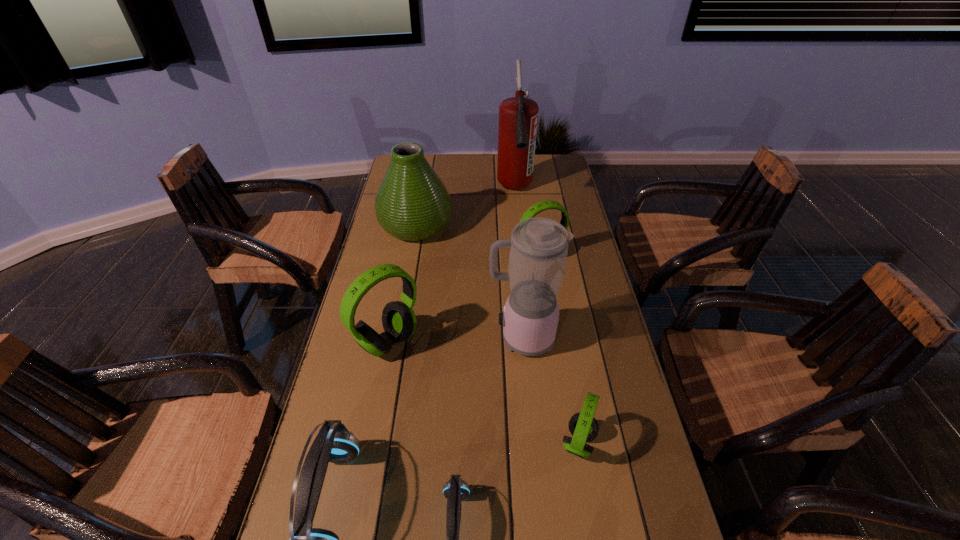
The width and height of the screenshot is (960, 540). In order to click on headset at the left edge in this screenshot , I will do `click(399, 322)`.

Find the location of a particular element. The width and height of the screenshot is (960, 540). vacant space at the far edge of the desktop is located at coordinates (487, 166).

Find the location of a particular element. vacant area at the left edge of the desktop is located at coordinates (412, 251).

This screenshot has height=540, width=960. I want to click on vacant space at the right edge of the desktop, so click(x=551, y=220).

Identify the location of vacant space that's between the seventh shortest object and the leftmost green headset. (455, 340).

Select which object is the fifth closest to the tallest object. Please provide its 2D coordinates. Your answer should be formatted as a tuple, i.e. [(x, y)], where the tuple contains the x and y coordinates of a point satisfying the conditions above.

[(583, 426)]

The height and width of the screenshot is (540, 960). What are the coordinates of `object that is the fourth nearest to the seventh tallest object` in the screenshot? It's located at (334, 443).

Locate which headset ranks fourth in proximity to the nearest green headset. Please provide its 2D coordinates. Your answer should be formatted as a tuple, i.e. [(x, y)], where the tuple contains the x and y coordinates of a point satisfying the conditions above.

[(544, 205)]

Choose which headset is the third nearest neighbor to the bigger blue headset. Please provide its 2D coordinates. Your answer should be formatted as a tuple, i.e. [(x, y)], where the tuple contains the x and y coordinates of a point satisfying the conditions above.

[(583, 426)]

Locate which green headset is the second closest to the seventh shortest object. Please provide its 2D coordinates. Your answer should be formatted as a tuple, i.e. [(x, y)], where the tuple contains the x and y coordinates of a point satisfying the conditions above.

[(399, 322)]